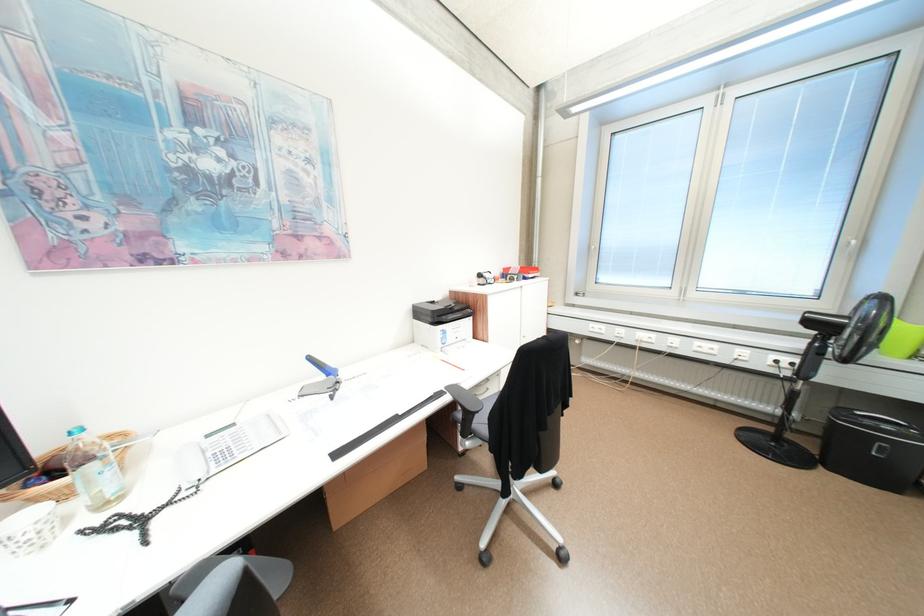
Locate an element on the screen. This screenshot has height=616, width=924. white window handle is located at coordinates (850, 248).